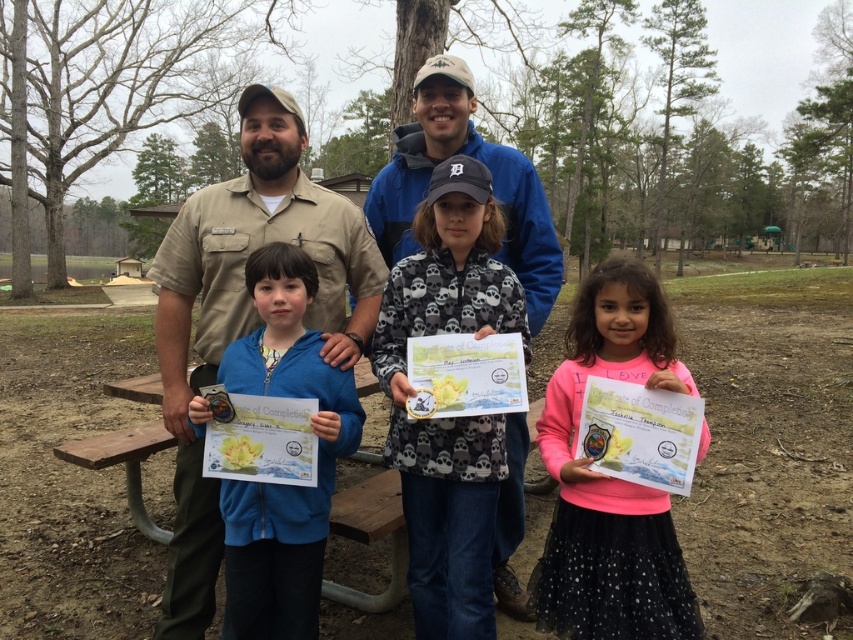
Question: Among these points, which one is nearest to the camera?

Choices:
 (A) (352, 401)
 (B) (241, 131)
 (C) (685, 385)
 (D) (402, 380)

Answer: (C)

Question: Observing the image, what is the correct spatial positioning of pink fabric dress at lower right in reference to blue fleece jacket at center?

Choices:
 (A) below
 (B) above

Answer: (B)

Question: Which point is closer to the camera taking this photo?

Choices:
 (A) (621, 637)
 (B) (180, 609)

Answer: (A)

Question: Does black skull-patterned jacket at center appear over matte blue jacket at center?

Choices:
 (A) yes
 (B) no

Answer: (B)

Question: Does black skull-patterned jacket at center have a larger size compared to matte blue jacket at center?

Choices:
 (A) yes
 (B) no

Answer: (A)

Question: Which point is farther to the camera?

Choices:
 (A) pink fabric dress at lower right
 (B) blue fleece jacket at center
 (C) matte blue jacket at center

Answer: (C)